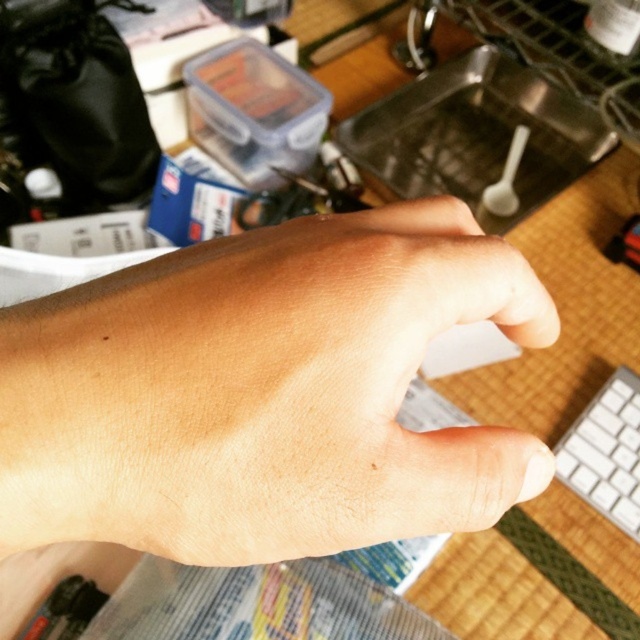
Question: Which of the following is the closest to the observer?

Choices:
 (A) (413, 362)
 (B) (634, 424)

Answer: (A)

Question: In this image, where is skinsmoothhand at center located relative to white plastic keyboard at lower right?

Choices:
 (A) above
 (B) below

Answer: (A)

Question: Can you confirm if skinsmoothhand at center is positioned below white plastic keyboard at lower right?

Choices:
 (A) yes
 (B) no

Answer: (B)

Question: Which point is farther to the camera?

Choices:
 (A) (634, 518)
 (B) (384, 240)

Answer: (A)

Question: Observing the image, what is the correct spatial positioning of skinsmoothhand at center in reference to white plastic keyboard at lower right?

Choices:
 (A) left
 (B) right

Answer: (A)

Question: Which point is closer to the camera?

Choices:
 (A) skinsmoothhand at center
 (B) white plastic keyboard at lower right

Answer: (A)